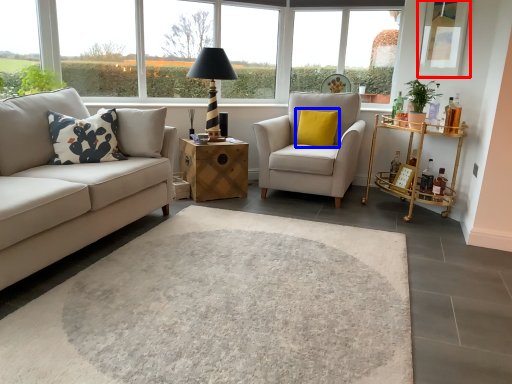
Question: Which object is closer to the camera taking this photo, window screen (highlighted by a red box) or pillow (highlighted by a blue box)?

Choices:
 (A) window screen
 (B) pillow

Answer: (A)